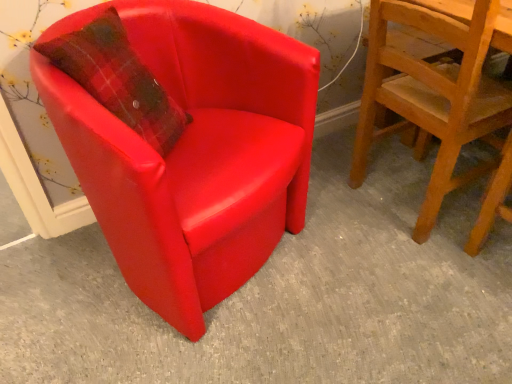
In order to click on matte red armchair at left, which ranks as the 1th chair in left-to-right order in this screenshot , I will do `click(190, 149)`.

Describe the element at coordinates (190, 149) in the screenshot. I see `matte red armchair at left, the second chair positioned from the right` at that location.

What is the approximate width of wooden textured chair at right, the second chair from the left?

19.34 inches.

Find the location of `wooden textured chair at right, the second chair from the left`. wooden textured chair at right, the second chair from the left is located at coordinates (431, 97).

This screenshot has height=384, width=512. What do you see at coordinates (431, 97) in the screenshot? I see `wooden textured chair at right, the first chair in the right-to-left sequence` at bounding box center [431, 97].

At what (x,y) coordinates should I click in order to perform the action: click on matte red armchair at left, the second chair positioned from the right. Please return your answer as a coordinate pair (x, y). Image resolution: width=512 pixels, height=384 pixels. Looking at the image, I should click on (190, 149).

Can you confirm if wooden textured chair at right, the first chair in the right-to-left sequence, is positioned to the left of matte red armchair at left, which ranks as the 1th chair in left-to-right order?

In fact, wooden textured chair at right, the first chair in the right-to-left sequence, is to the right of matte red armchair at left, which ranks as the 1th chair in left-to-right order.

Is wooden textured chair at right, the second chair from the left, in front of or behind matte red armchair at left, which ranks as the 1th chair in left-to-right order, in the image?

wooden textured chair at right, the second chair from the left, is positioned farther from the viewer than matte red armchair at left, which ranks as the 1th chair in left-to-right order.

Considering the points (423, 96) and (224, 83), which point is in front, point (423, 96) or point (224, 83)?

The point (224, 83) is in front.

From the image's perspective, does wooden textured chair at right, the second chair from the left, appear higher than matte red armchair at left, the second chair positioned from the right?

Yes, from the image's perspective, wooden textured chair at right, the second chair from the left, is on top of matte red armchair at left, the second chair positioned from the right.

From a real-world perspective, which object stands above the other?

wooden textured chair at right, the second chair from the left, from a real-world perspective.

Considering the sizes of objects wooden textured chair at right, the second chair from the left, and matte red armchair at left, which ranks as the 1th chair in left-to-right order, in the image provided, who is wider, wooden textured chair at right, the second chair from the left, or matte red armchair at left, which ranks as the 1th chair in left-to-right order,?

matte red armchair at left, which ranks as the 1th chair in left-to-right order, is wider.

Considering the sizes of wooden textured chair at right, the second chair from the left, and matte red armchair at left, the second chair positioned from the right, in the image, is wooden textured chair at right, the second chair from the left, taller or shorter than matte red armchair at left, the second chair positioned from the right,?

wooden textured chair at right, the second chair from the left, is taller than matte red armchair at left, the second chair positioned from the right.

Does wooden textured chair at right, the second chair from the left, have a larger size compared to matte red armchair at left, the second chair positioned from the right?

No.

Looking at this image, can matte red armchair at left, the second chair positioned from the right, be found inside wooden textured chair at right, the second chair from the left?

No, matte red armchair at left, the second chair positioned from the right, is located outside of wooden textured chair at right, the second chair from the left.

Is wooden textured chair at right, the second chair from the left, beside matte red armchair at left, which ranks as the 1th chair in left-to-right order?

No, wooden textured chair at right, the second chair from the left, is not next to matte red armchair at left, which ranks as the 1th chair in left-to-right order.

Is wooden textured chair at right, the first chair in the right-to-left sequence, positioned with its back to matte red armchair at left, the second chair positioned from the right?

Yes.

How different are the orientations of wooden textured chair at right, the second chair from the left, and matte red armchair at left, the second chair positioned from the right, in degrees?

67.8 degrees separate the facing orientations of wooden textured chair at right, the second chair from the left, and matte red armchair at left, the second chair positioned from the right.

How much distance is there between wooden textured chair at right, the second chair from the left, and matte red armchair at left, which ranks as the 1th chair in left-to-right order?

wooden textured chair at right, the second chair from the left, is 22.98 inches from matte red armchair at left, which ranks as the 1th chair in left-to-right order.

In order to click on chair behind the matte red armchair at left, which ranks as the 1th chair in left-to-right order in this screenshot , I will do point(431,97).

Which object is positioned more to the left, matte red armchair at left, the second chair positioned from the right, or wooden textured chair at right, the second chair from the left?

matte red armchair at left, the second chair positioned from the right.

Who is more distant, matte red armchair at left, the second chair positioned from the right, or wooden textured chair at right, the second chair from the left?

wooden textured chair at right, the second chair from the left.

Between point (263, 219) and point (420, 61), which one is positioned in front?

The point (263, 219) is closer to the camera.

From the image's perspective, is matte red armchair at left, the second chair positioned from the right, positioned above or below wooden textured chair at right, the second chair from the left?

matte red armchair at left, the second chair positioned from the right, is below wooden textured chair at right, the second chair from the left.

From a real-world perspective, which is physically below, matte red armchair at left, which ranks as the 1th chair in left-to-right order, or wooden textured chair at right, the second chair from the left?

matte red armchair at left, which ranks as the 1th chair in left-to-right order, is physically lower.

Between matte red armchair at left, the second chair positioned from the right, and wooden textured chair at right, the first chair in the right-to-left sequence, which one has smaller width?

wooden textured chair at right, the first chair in the right-to-left sequence, is thinner.

Is matte red armchair at left, the second chair positioned from the right, taller than wooden textured chair at right, the first chair in the right-to-left sequence?

No, matte red armchair at left, the second chair positioned from the right, is not taller than wooden textured chair at right, the first chair in the right-to-left sequence.

In the scene shown: Can you confirm if matte red armchair at left, the second chair positioned from the right, is bigger than wooden textured chair at right, the first chair in the right-to-left sequence?

Yes.

Would you say matte red armchair at left, the second chair positioned from the right, is outside wooden textured chair at right, the first chair in the right-to-left sequence?

Absolutely, matte red armchair at left, the second chair positioned from the right, is external to wooden textured chair at right, the first chair in the right-to-left sequence.

Is matte red armchair at left, which ranks as the 1th chair in left-to-right order, next to wooden textured chair at right, the second chair from the left?

matte red armchair at left, which ranks as the 1th chair in left-to-right order, and wooden textured chair at right, the second chair from the left, are not in contact.

Looking at this image, is matte red armchair at left, which ranks as the 1th chair in left-to-right order, looking in the opposite direction of wooden textured chair at right, the second chair from the left?

No, wooden textured chair at right, the second chair from the left, is not at the back of matte red armchair at left, which ranks as the 1th chair in left-to-right order.

How far apart are matte red armchair at left, the second chair positioned from the right, and wooden textured chair at right, the second chair from the left?

matte red armchair at left, the second chair positioned from the right, and wooden textured chair at right, the second chair from the left, are 58.37 centimeters apart from each other.

At what (x,y) coordinates should I click in order to perform the action: click on chair above the matte red armchair at left, which ranks as the 1th chair in left-to-right order (from the image's perspective). Please return your answer as a coordinate pair (x, y). Looking at the image, I should click on (431, 97).

What are the coordinates of `chair behind the matte red armchair at left, the second chair positioned from the right` in the screenshot? It's located at (431, 97).

I want to click on chair lying on the right of matte red armchair at left, the second chair positioned from the right, so click(431, 97).